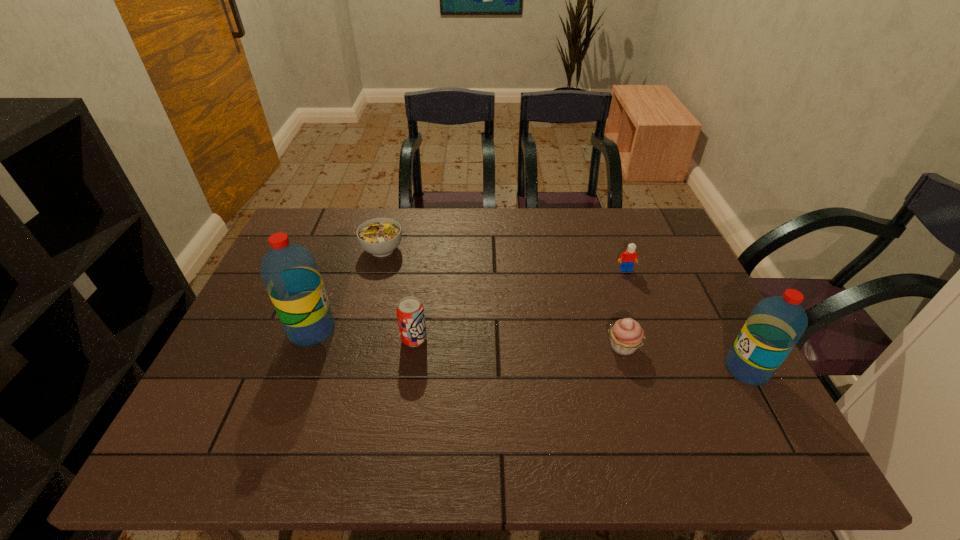
Where is `object that is at the near edge`? Image resolution: width=960 pixels, height=540 pixels. object that is at the near edge is located at coordinates (775, 325).

Where is `object at the left edge`? This screenshot has width=960, height=540. object at the left edge is located at coordinates (289, 271).

I want to click on water bottle located at the right edge, so click(x=775, y=325).

Locate an element on the screen. Lego that is at the right edge is located at coordinates (627, 259).

Where is `object present at the near right corner`? object present at the near right corner is located at coordinates (x=775, y=325).

In the image, there is a desktop. What are the coordinates of `vacant space at the far edge` in the screenshot? It's located at (551, 231).

In the image, there is a desktop. Identify the location of vacant space at the near edge. (280, 386).

Locate an element on the screen. vacant point at the left edge is located at coordinates (248, 361).

Locate an element on the screen. This screenshot has height=540, width=960. blank area at the right edge is located at coordinates (697, 372).

Locate an element on the screen. The width and height of the screenshot is (960, 540). vacant region at the far left corner of the desktop is located at coordinates (288, 233).